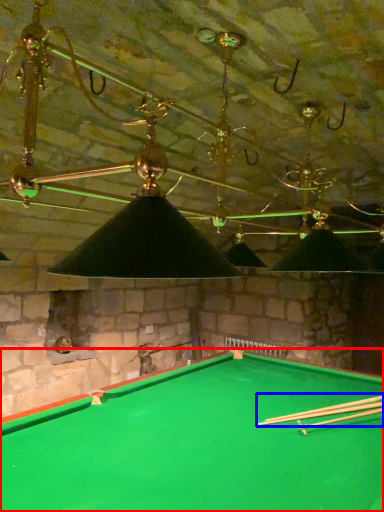
Question: Which object appears closest to the camera in this image, billiard table (highlighted by a red box) or cue (highlighted by a blue box)?

Choices:
 (A) billiard table
 (B) cue

Answer: (A)